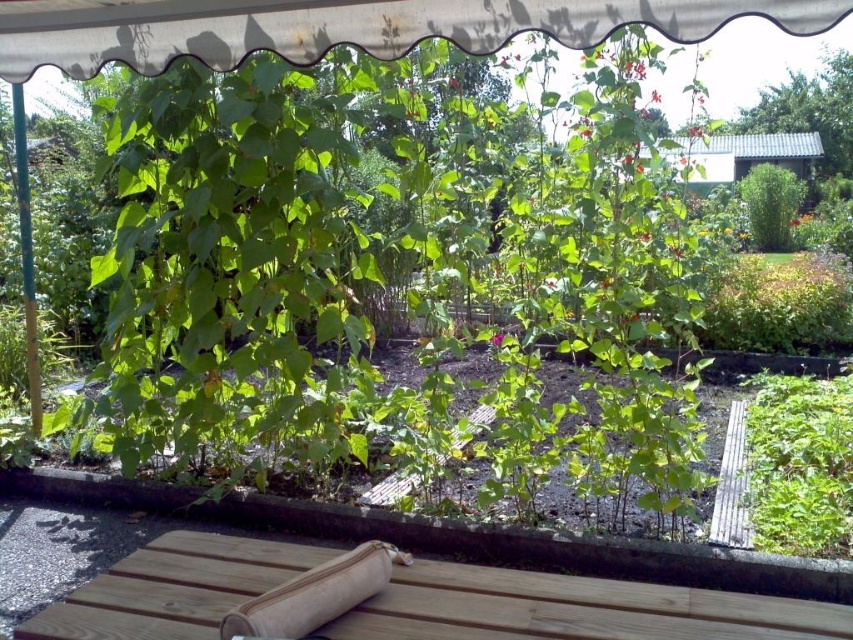
You are planning to set up a picnic in the garden and have a natural wood picnic table at lower center and a beige fabric rolling pin at lower center. Which object can accommodate more items due to its size?

The natural wood picnic table at lower center has a larger size compared to the beige fabric rolling pin at lower center, so it can accommodate more items.

You are standing in the garden and see two points marked in the scene. According to their positions, which point is closer to you? The points are labeled as point (646, 596) and point (375, 570).

Point (375, 570) is closer to you because it is in front of point (646, 596).

You are standing in the garden and want to take a photo of both the wooden bench with a cushion and the tall leafy plants growing on the metal trellis. If you position yourself so that the point at coordinate point (839, 506) is closer to you than point (305, 589), will you be able to capture both subjects in the frame?

The point at coordinate point (839, 506) is further to the camera than point (305, 589). Therefore, positioning yourself so that point (839, 506) is closer to you would require adjusting your position to bring it forward. However, since the wooden bench with a cushion is under the scalloped awning and the tall leafy plants are supported by the metal trellis behind them, you might need to ensure both are within your camera frame by angling appropriately. But based on the given spatial relationship, the